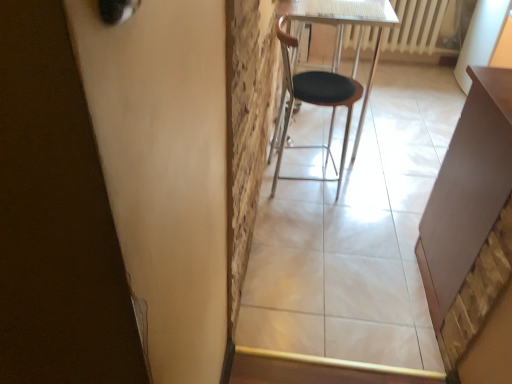
Locate an element on the screen. The height and width of the screenshot is (384, 512). free space in front of black leather chair at center is located at coordinates (317, 231).